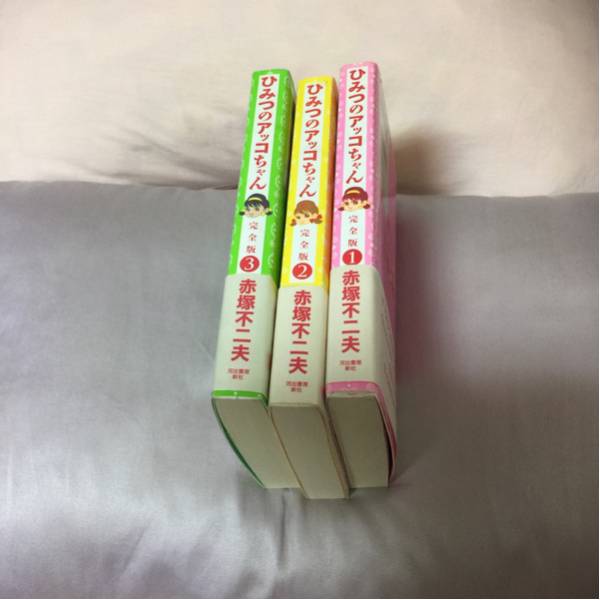
In order to click on bottom side of book in this screenshot , I will do `click(257, 441)`.